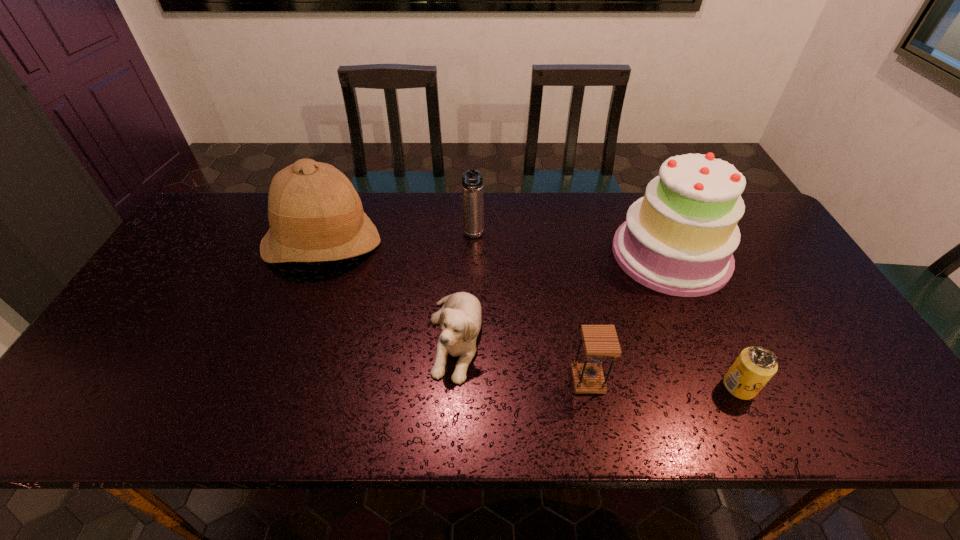
Find the location of `vacant space located on the front-facing side of the puppy`. vacant space located on the front-facing side of the puppy is located at coordinates (451, 433).

The height and width of the screenshot is (540, 960). I want to click on vacant space situated on the left of the beer can, so point(614,386).

Find the location of a particular element. Image resolution: width=960 pixels, height=540 pixels. cake that is positioned at the far edge is located at coordinates (679, 239).

The image size is (960, 540). I want to click on hat present at the far edge, so click(x=315, y=214).

The height and width of the screenshot is (540, 960). Identify the location of thermos bottle present at the far edge. (472, 180).

Identify the location of object located at the near edge. This screenshot has width=960, height=540. (755, 366).

Locate an element on the screen. This screenshot has height=540, width=960. vacant area at the far edge is located at coordinates (546, 226).

Image resolution: width=960 pixels, height=540 pixels. I want to click on vacant space at the near edge of the desktop, so click(x=572, y=396).

The image size is (960, 540). In the image, there is a desktop. What are the coordinates of `vacant region at the left edge` in the screenshot? It's located at (100, 360).

The height and width of the screenshot is (540, 960). I want to click on vacant space at the right edge, so click(824, 385).